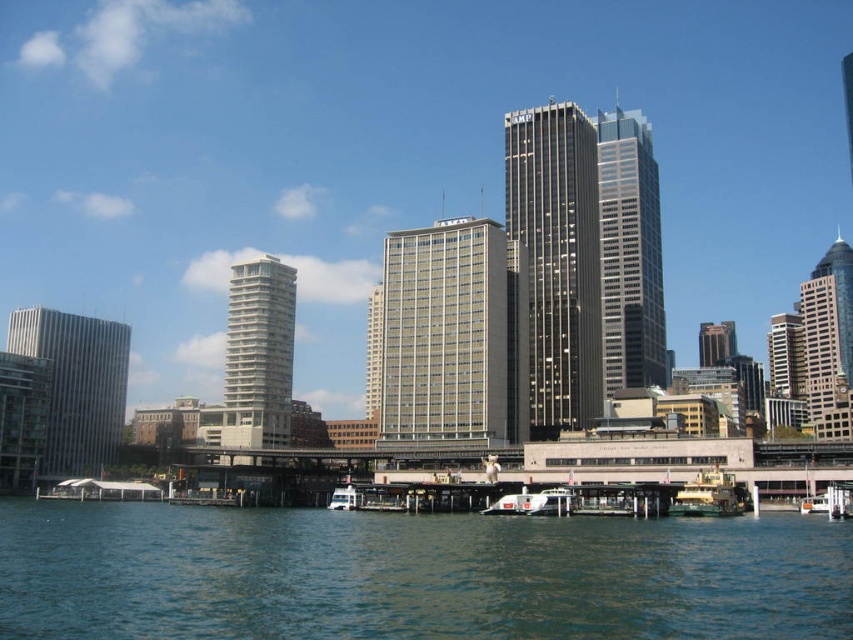
Who is positioned more to the left, dark gray glass skyscraper at center or green painted metal ferry at lower center?

green painted metal ferry at lower center

Who is more distant from viewer, (605, 280) or (722, 477)?

The point (605, 280) is behind.

The width and height of the screenshot is (853, 640). What are the coordinates of `dark gray glass skyscraper at center` in the screenshot? It's located at (630, 253).

Based on the photo, can you confirm if black glass skyscraper at center is positioned above gray glass building at left?

Yes.

Does point (561, 234) lie in front of point (56, 358)?

That is True.

At what (x,y) coordinates should I click in order to perform the action: click on black glass skyscraper at center. Please return your answer as a coordinate pair (x, y). The height and width of the screenshot is (640, 853). Looking at the image, I should click on (556, 259).

Between gray concrete building at center and black glass skyscraper at center, which one is positioned lower?

Positioned lower is gray concrete building at center.

Which is above, gray concrete building at center or black glass skyscraper at center?

Positioned higher is black glass skyscraper at center.

Who is more forward, (x=520, y=413) or (x=582, y=177)?

Point (x=520, y=413)

In order to click on gray concrete building at center in this screenshot , I will do pos(451,337).